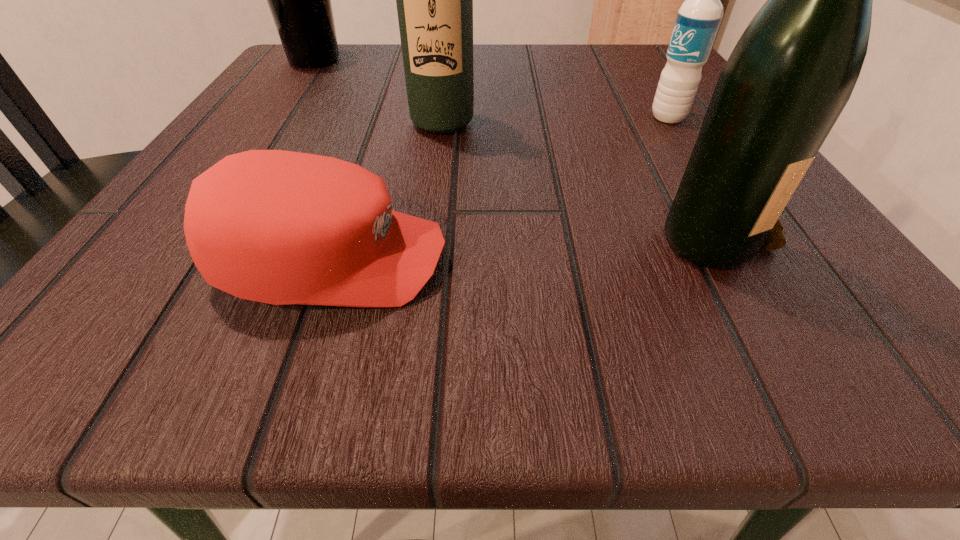
Locate an element on the screen. the leftmost wine bottle is located at coordinates (299, 0).

You are a GUI agent. You are given a task and a screenshot of the screen. Output one action in this format:
    pyautogui.click(x=<x>, y=<y>)
    Task: Click on the farthest wine bottle
    Image resolution: width=960 pixels, height=540 pixels.
    Given the screenshot: What is the action you would take?
    pyautogui.click(x=299, y=0)

The width and height of the screenshot is (960, 540). I want to click on the second farthest wine bottle, so click(x=434, y=0).

Find the location of `the rightmost wine bottle`. the rightmost wine bottle is located at coordinates (793, 70).

You are a GUI agent. You are given a task and a screenshot of the screen. Output one action in this format:
    pyautogui.click(x=<x>, y=<y>)
    Task: Click on the water bottle
    
    Given the screenshot: What is the action you would take?
    [x=698, y=19]

At what (x,y) coordinates should I click in order to perform the action: click on the shortest object. Please return your answer as a coordinate pair (x, y). The width and height of the screenshot is (960, 540). Looking at the image, I should click on (279, 227).

Identify the location of free space located 0.370m on the label of the farthest wine bottle. (538, 60).

This screenshot has width=960, height=540. What are the coordinates of `vacant point located 0.080m on the labeled side of the second wine bottle from left to right` in the screenshot? It's located at (437, 169).

Identify the location of vacant region located on the back of the nearest wine bottle. This screenshot has width=960, height=540. (629, 83).

Where is `vacant space situated on the label of the water bottle`? vacant space situated on the label of the water bottle is located at coordinates (390, 117).